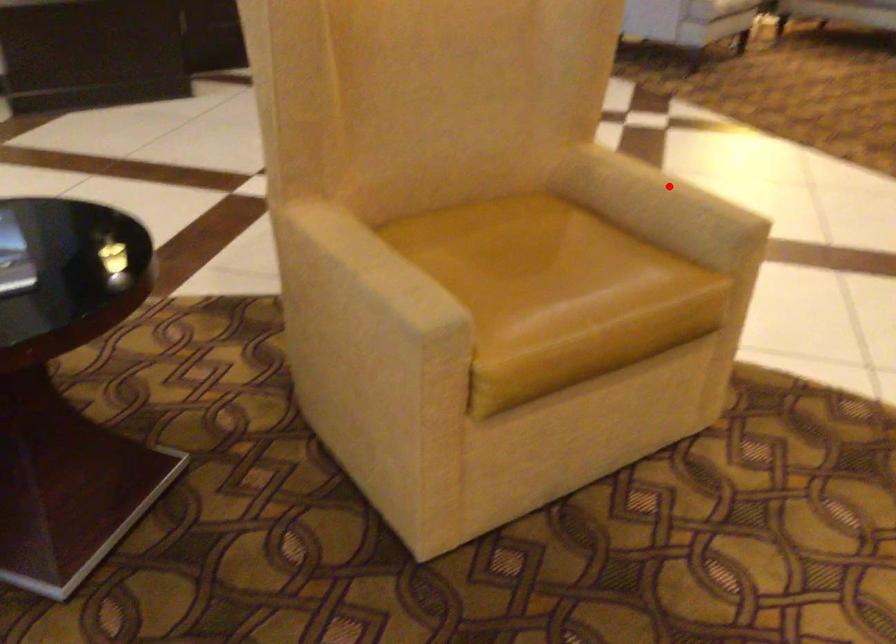
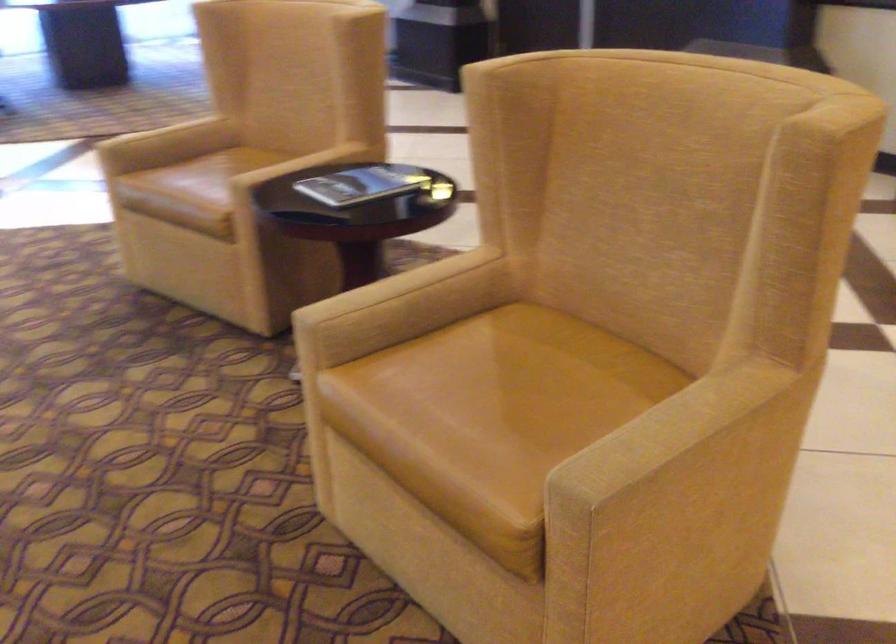
Locate, in the second image, the point that corresponds to the highlighted location in the first image.

(707, 433)